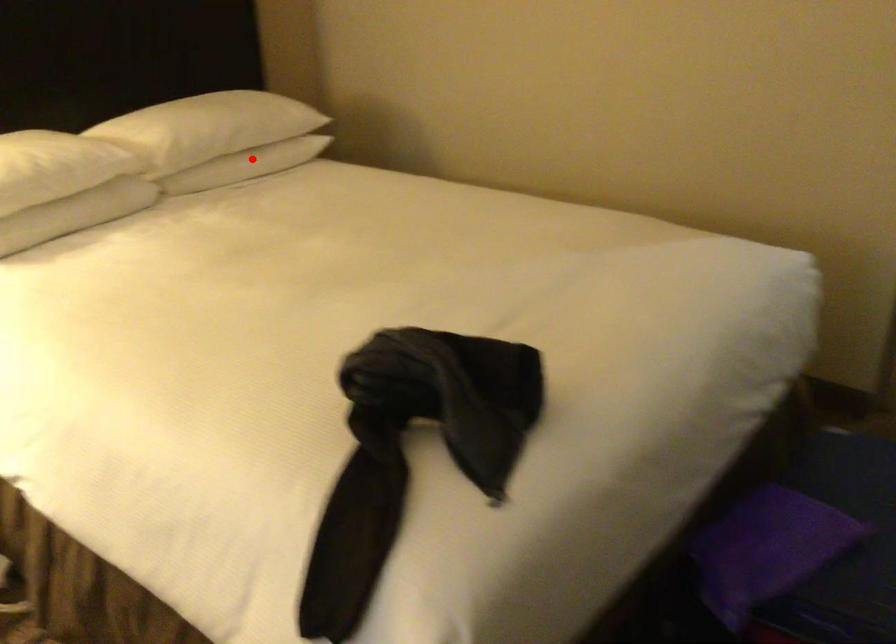
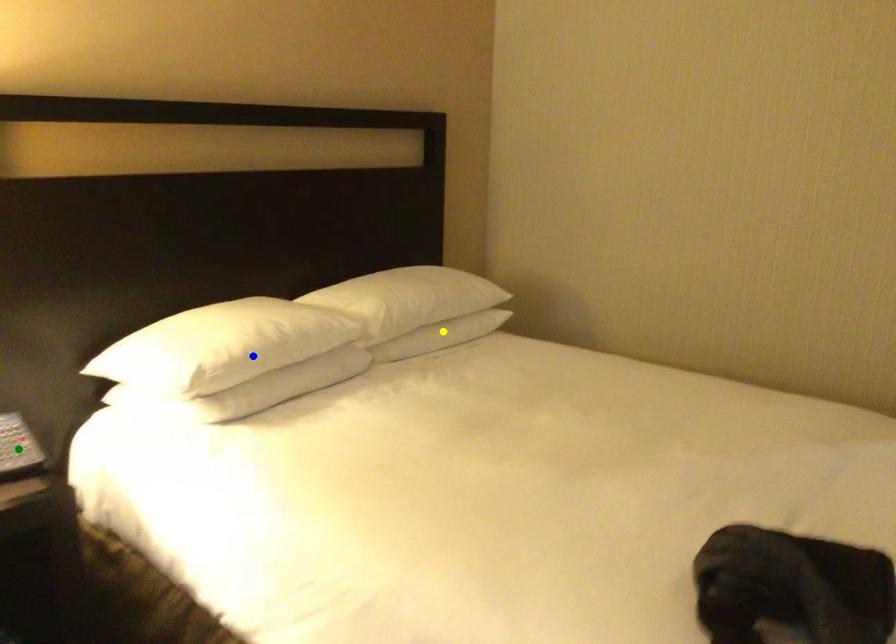
Question: I am providing you with two images of the same scene from different viewpoints. A red point is marked on the first image. You are given multiple points on the second image. Which spot in image 2 lines up with the point in image 1?

Choices:
 (A) green point
 (B) blue point
 (C) yellow point

Answer: (C)